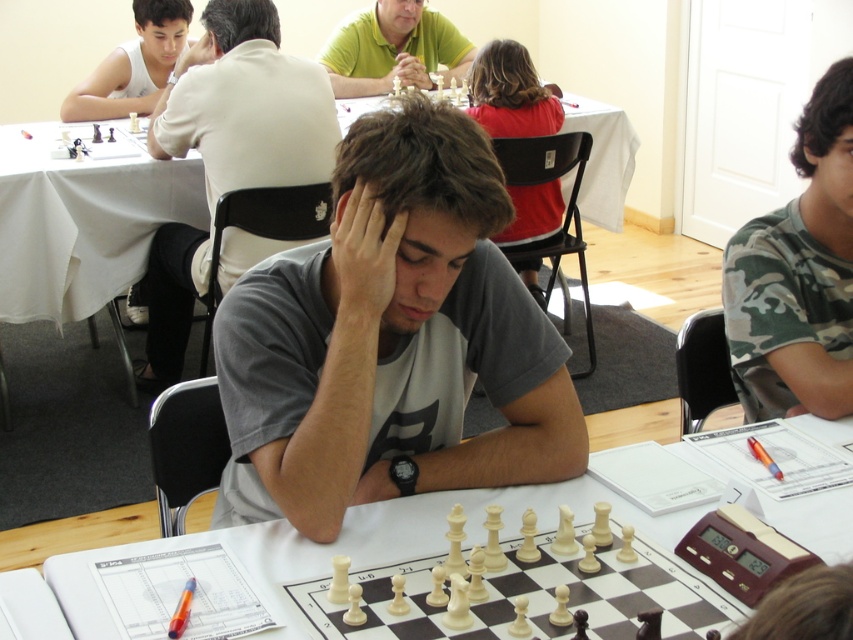
Question: Which point is closer to the camera?

Choices:
 (A) yellow-green shirt at center
 (B) white cloth table at center
 (C) dark brown hair at upper right
 (D) camo fabric shirt at right

Answer: (D)

Question: Is matte white head at upper left further to the viewer compared to yellow-green shirt at center?

Choices:
 (A) no
 (B) yes

Answer: (A)

Question: Can you confirm if gray cotton shirt at center is positioned above yellow-green shirt at center?

Choices:
 (A) no
 (B) yes

Answer: (A)

Question: Based on their relative distances, which object is farther from the smooth beige shirt at upper center?

Choices:
 (A) dark gray hair at center
 (B) matte green polo shirt at center
 (C) yellow-green shirt at center
 (D) white plastic chessboard at center

Answer: (D)

Question: In this image, where is white plastic chessboard at center located relative to yellow-green shirt at center?

Choices:
 (A) left
 (B) right

Answer: (B)

Question: Which point is farther to the camera?

Choices:
 (A) yellow-green shirt at center
 (B) white cloth table at center
 (C) gray cotton shirt at upper center

Answer: (A)